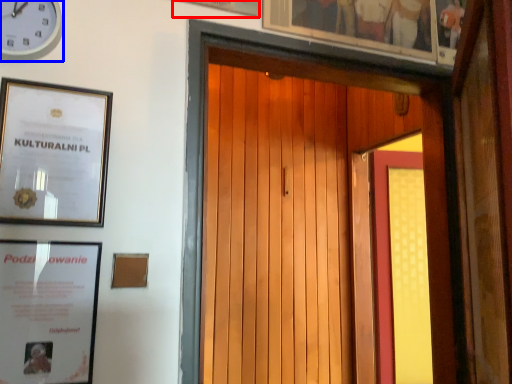
Question: Which point is closer to the camera, picture frame (highlighted by a red box) or clock (highlighted by a blue box)?

Choices:
 (A) picture frame
 (B) clock

Answer: (B)